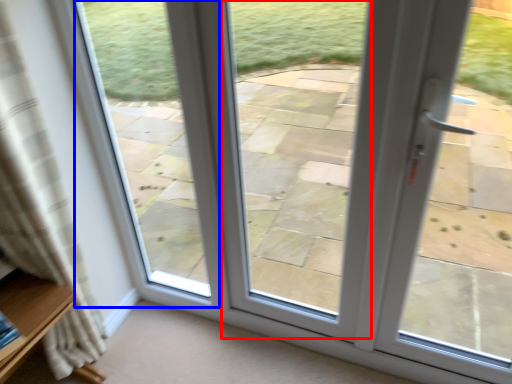
Question: Which point is further to the camera, window (highlighted by a red box) or bay window (highlighted by a blue box)?

Choices:
 (A) window
 (B) bay window

Answer: (B)